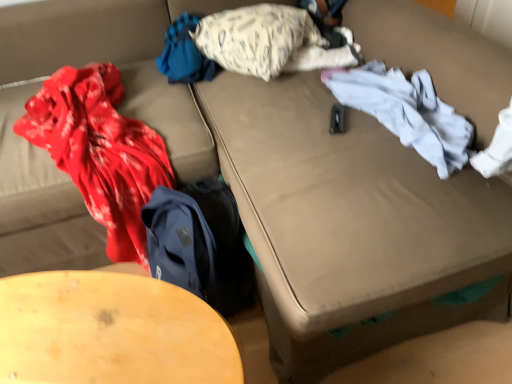
This screenshot has width=512, height=384. Identify the location of empty space that is ontop of wooden table at lower left (from a real-world perspective). (99, 325).